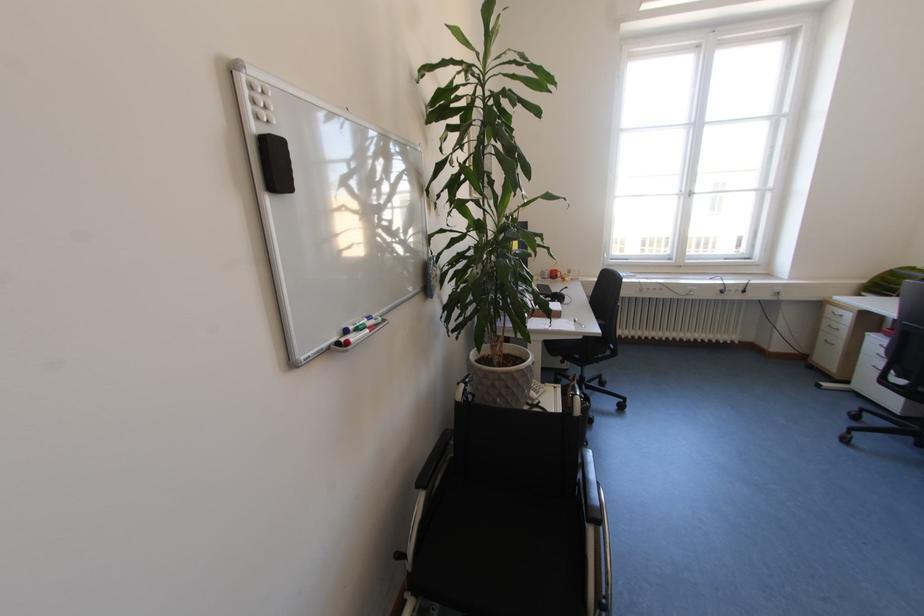
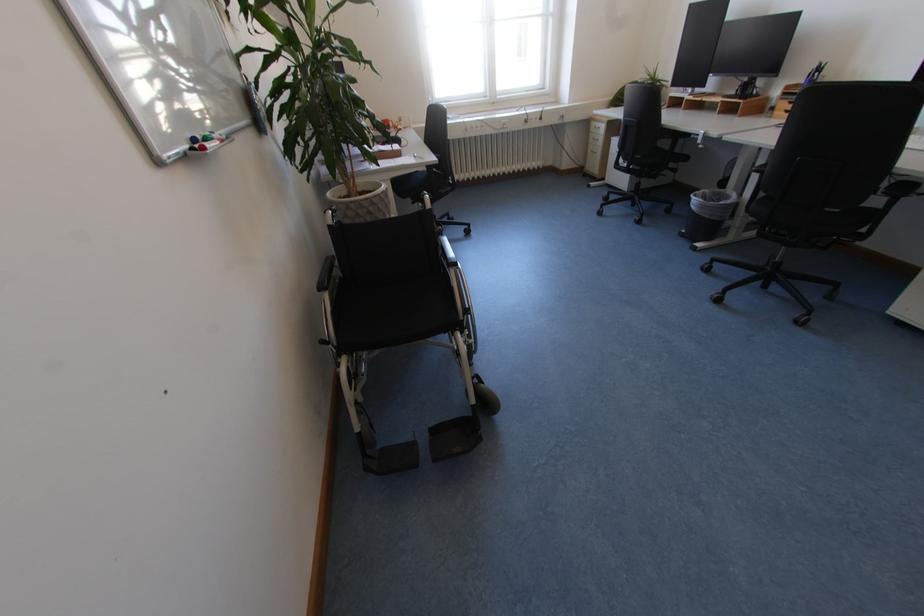
The images are taken continuously from a first-person perspective. In which direction is your viewpoint rotating?

The rotation direction of the camera is right-down.